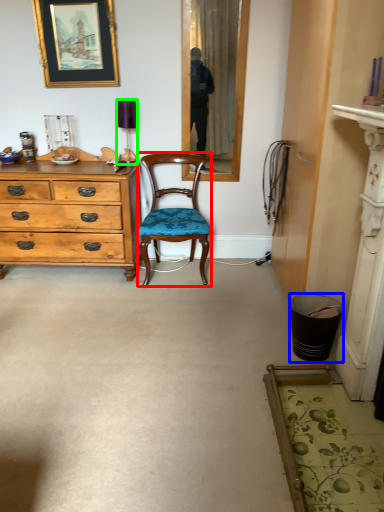
Question: Considering the real-world distances, which object is farthest from chair (highlighted by a red box)? trash bin/can (highlighted by a blue box) or lamp (highlighted by a green box)?

Choices:
 (A) trash bin/can
 (B) lamp

Answer: (A)